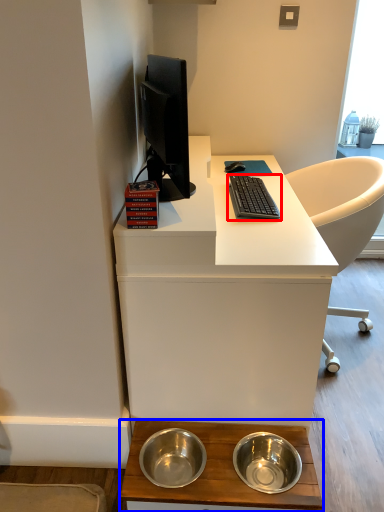
Question: Among these objects, which one is nearest to the camera, computer keyboard (highlighted by a red box) or desk (highlighted by a blue box)?

Choices:
 (A) computer keyboard
 (B) desk

Answer: (B)